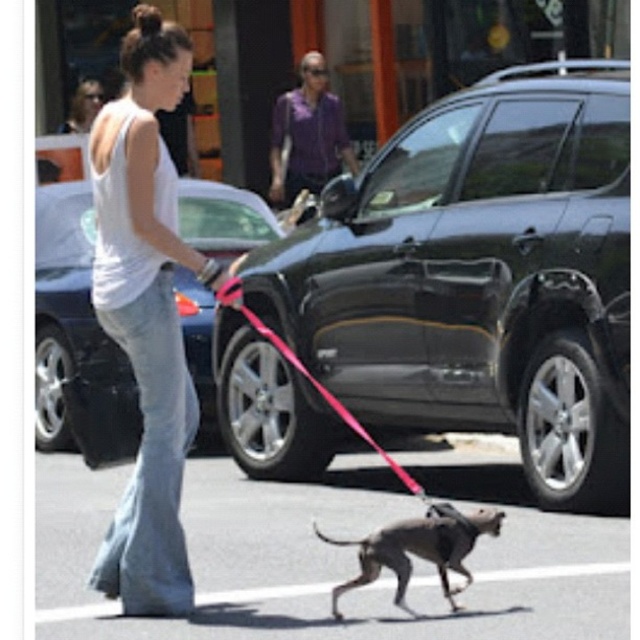
Can you confirm if shiny black car at center is taller than gray smooth dog at center?

Yes, shiny black car at center is taller than gray smooth dog at center.

Does point (211, 420) come in front of point (460, 544)?

No, (211, 420) is behind (460, 544).

Identify the location of shiny black car at center. (76, 339).

Measure the distance between white cotton tank top at center and camera.

white cotton tank top at center and camera are 6.57 meters apart.

Between point (134, 460) and point (196, 192), which one is positioned in front?

Point (134, 460)

What do you see at coordinates (147, 314) in the screenshot? I see `white cotton tank top at center` at bounding box center [147, 314].

Locate an element on the screen. The height and width of the screenshot is (640, 640). white cotton tank top at center is located at coordinates (147, 314).

Is white cotton tank top at center positioned at the back of gray smooth dog at center?

No, white cotton tank top at center is in front of gray smooth dog at center.

Can you confirm if white cotton tank top at center is positioned to the left of gray smooth dog at center?

Correct, you'll find white cotton tank top at center to the left of gray smooth dog at center.

The width and height of the screenshot is (640, 640). In order to click on white cotton tank top at center in this screenshot , I will do `click(147, 314)`.